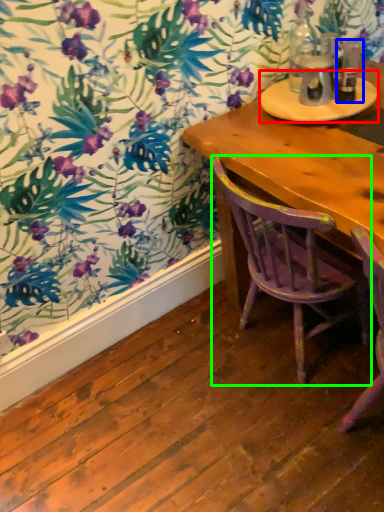
Question: Which is nearer to the round table (highlighted by a red box)? bottle (highlighted by a blue box) or chair (highlighted by a green box).

Choices:
 (A) bottle
 (B) chair

Answer: (A)